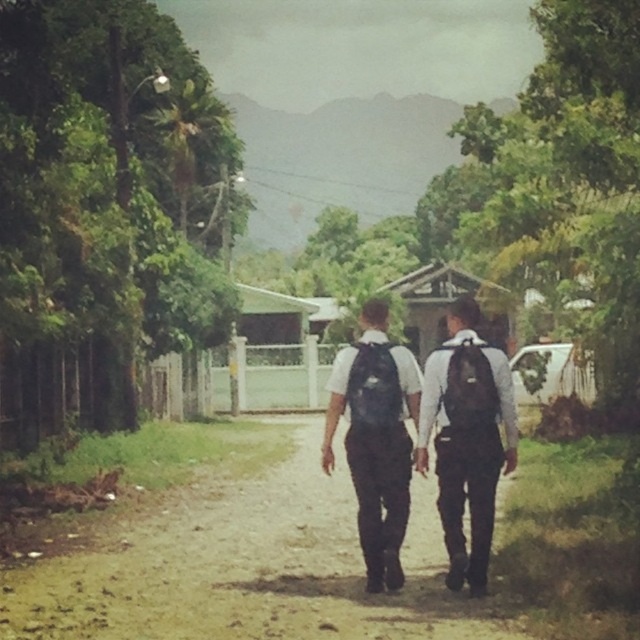
Does point (17, 582) come farther from viewer compared to point (488, 387)?

Yes.

Is brown dirt track at center closer to camera compared to black matte backpacks at center?

Yes, it is in front of black matte backpacks at center.

In order to click on brown dirt track at center in this screenshot , I will do `click(246, 566)`.